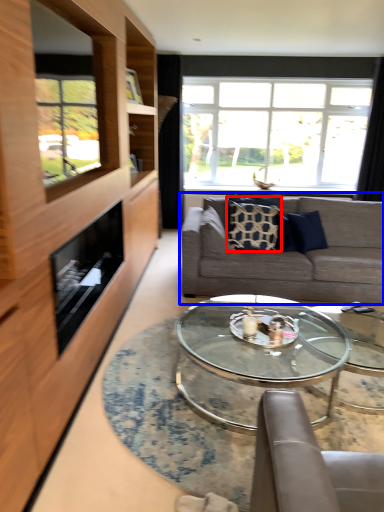
Question: Which object appears closest to the camera in this image, pillow (highlighted by a red box) or studio couch (highlighted by a blue box)?

Choices:
 (A) pillow
 (B) studio couch

Answer: (B)